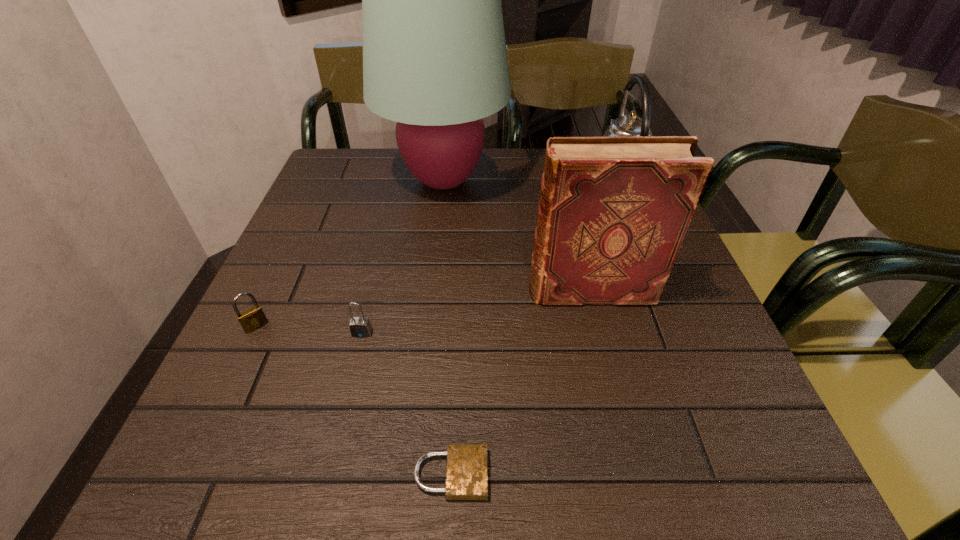
Locate an element on the screen. This screenshot has width=960, height=540. the tallest object is located at coordinates (435, 61).

You are a GUI agent. You are given a task and a screenshot of the screen. Output one action in this format:
    pyautogui.click(x=<x>, y=<y>)
    Task: Click on the third farthest object
    
    Given the screenshot: What is the action you would take?
    pyautogui.click(x=613, y=213)

The image size is (960, 540). Find the location of `kettle`. kettle is located at coordinates (626, 125).

This screenshot has width=960, height=540. Find the location of `the leftmost padlock`. the leftmost padlock is located at coordinates (254, 318).

Identify the location of the second padlock from left to right. (360, 327).

Identify the location of the nearest object. (466, 476).

Image resolution: width=960 pixels, height=540 pixels. Find the location of `the shortest object`. the shortest object is located at coordinates (466, 476).

Find the location of a particular element. Image resolution: width=960 pixels, height=540 pixels. vacant area located on the right of the lampshade is located at coordinates [x=638, y=180].

What are the coordinates of `blank area located on the spine side of the third farthest object` in the screenshot? It's located at (343, 291).

At what (x,y) coordinates should I click in order to perform the action: click on vacant space located on the spine side of the third farthest object. Please return your answer as a coordinate pair (x, y). This screenshot has height=540, width=960. Looking at the image, I should click on (338, 291).